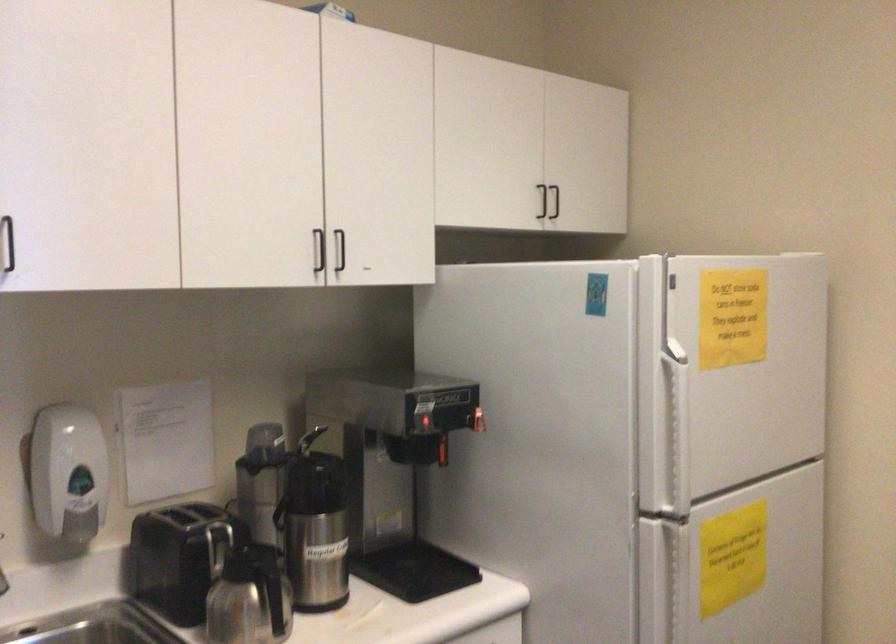
Locate an element on the screen. Image resolution: width=896 pixels, height=644 pixels. red dispenser lever is located at coordinates (442, 451).